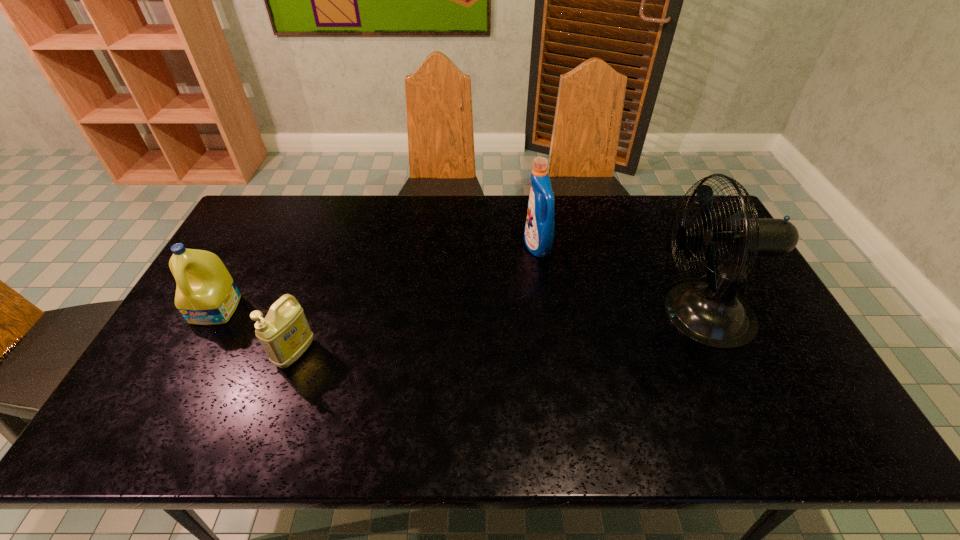
Find the location of a particular element. The width and height of the screenshot is (960, 540). vacant space positioned on the front-facing side of the tallest object is located at coordinates (524, 314).

Where is `vacant space located on the label of the second object from right to left`? Image resolution: width=960 pixels, height=540 pixels. vacant space located on the label of the second object from right to left is located at coordinates (421, 246).

Where is `vacant area situated on the label of the second object from right to left`? This screenshot has width=960, height=540. vacant area situated on the label of the second object from right to left is located at coordinates (419, 246).

Where is `vacant space situated on the label of the second object from right to left`? The image size is (960, 540). vacant space situated on the label of the second object from right to left is located at coordinates (464, 246).

Find the location of a particular element. This screenshot has width=960, height=540. vacant space located on the label of the leftmost object is located at coordinates (x=146, y=437).

Identify the location of free space located 0.280m on the left of the second object from left to right. pyautogui.click(x=171, y=353).

Where is `object at the far edge`? The image size is (960, 540). object at the far edge is located at coordinates (539, 230).

Identify the location of object that is at the left edge. This screenshot has height=540, width=960. (206, 294).

What are the coordinates of `object present at the right edge` in the screenshot? It's located at (711, 313).

Where is `vacant space at the far edge`? Image resolution: width=960 pixels, height=540 pixels. vacant space at the far edge is located at coordinates (411, 236).